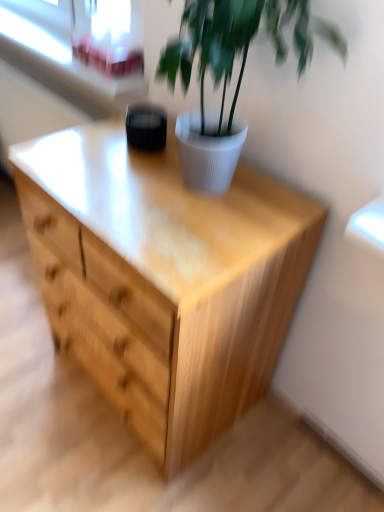
Identify the location of vacant area that is in front of white ribbed pot at upper center. The image size is (384, 512). (187, 243).